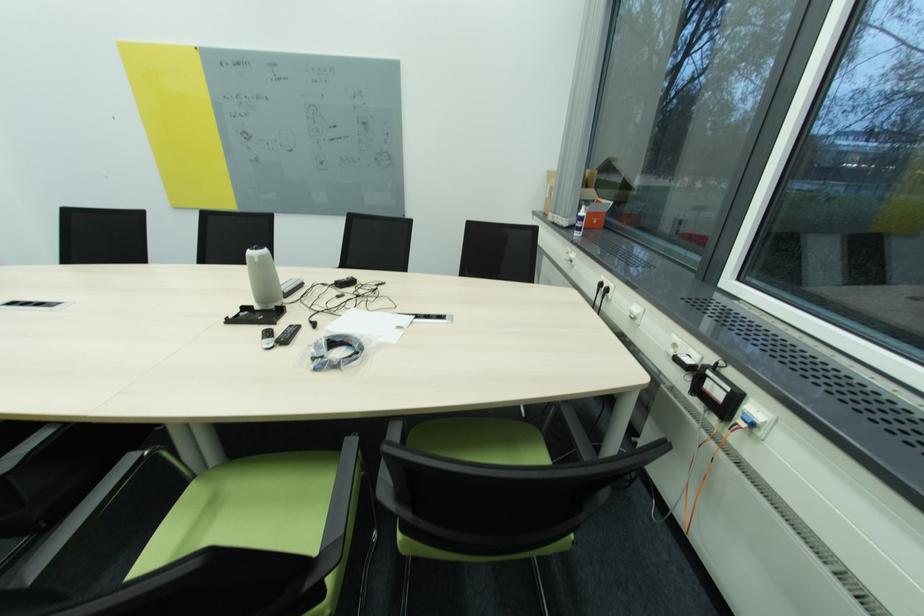
The location [596,185] corresponds to which object?

It refers to a cardboard box.